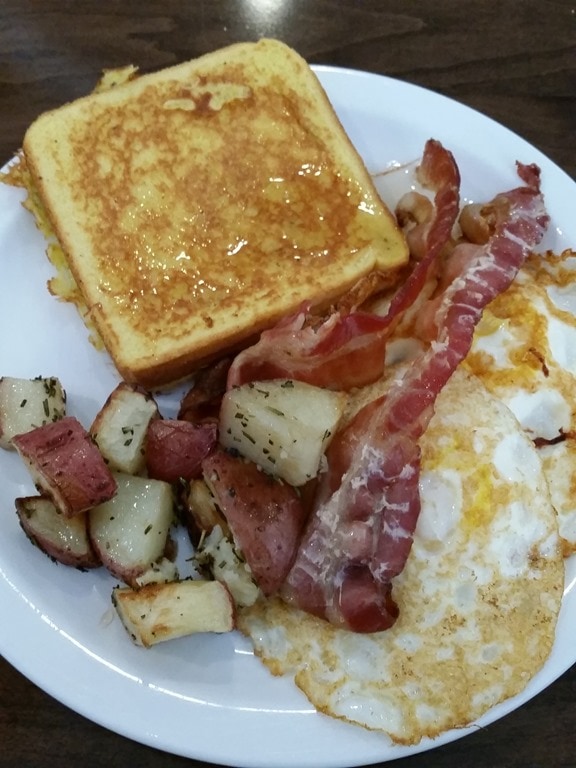
Where is `rim of the white plate`? The image size is (576, 768). rim of the white plate is located at coordinates (118, 729).